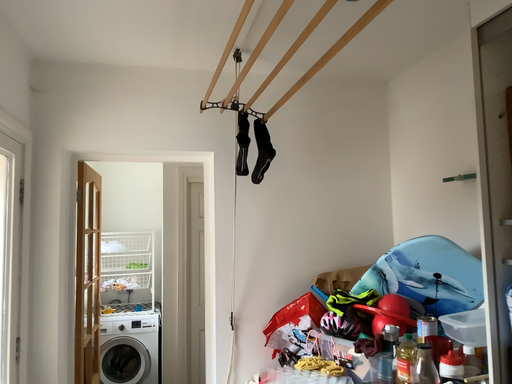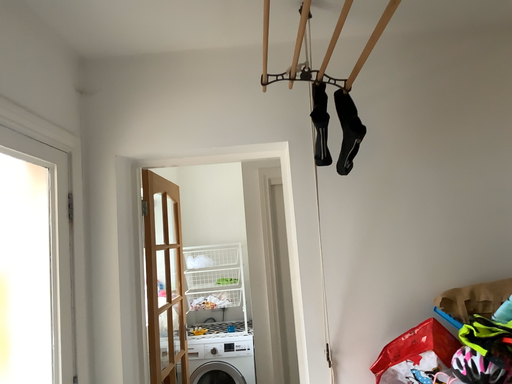
Question: How did the camera likely rotate when shooting the video?

Choices:
 (A) rotated right
 (B) rotated left

Answer: (B)